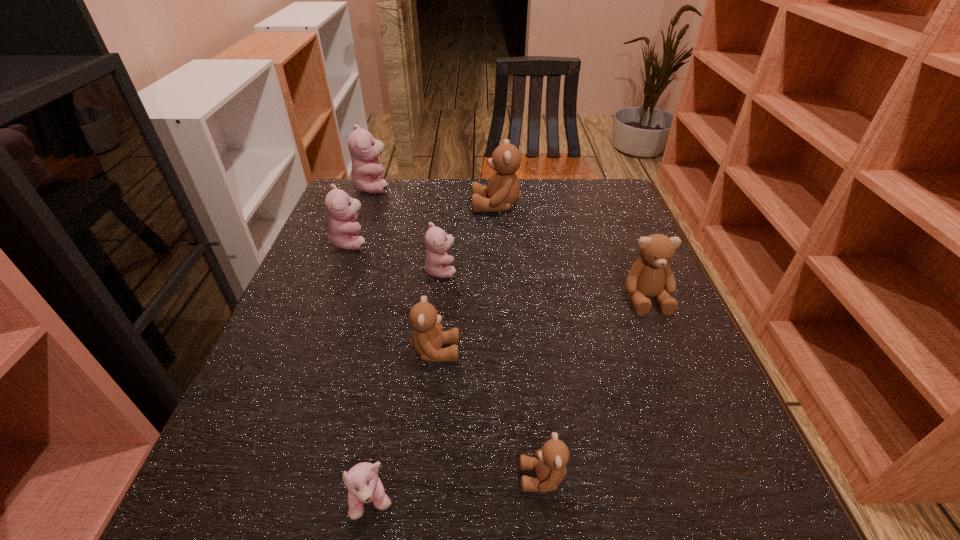
Find the location of a particular element. This screenshot has width=960, height=540. vacant space in between the second nearest brown teddy bear and the farthest pink teddy bear is located at coordinates (404, 269).

You are a GUI agent. You are given a task and a screenshot of the screen. Output one action in this format:
    pyautogui.click(x=<x>, y=<y>)
    Task: Click on the object that is the closest to the farthest brown teddy bear
    This screenshot has height=540, width=960.
    Given the screenshot: What is the action you would take?
    pyautogui.click(x=437, y=242)

At what (x,y) coordinates should I click in order to perform the action: click on object that is the third closest to the third farthest brown teddy bear. Please return your answer as a coordinate pair (x, y). This screenshot has width=960, height=540. Looking at the image, I should click on (364, 486).

Locate which teddy bear ranks in proximity to the second smallest pink teddy bear. Please provide its 2D coordinates. Your answer should be formatted as a tuple, i.e. [(x, y)], where the tuple contains the x and y coordinates of a point satisfying the conditions above.

[(344, 233)]

At what (x,y) coordinates should I click in order to perform the action: click on teddy bear that is the fourth nearest to the smallest pink teddy bear. Please return your answer as a coordinate pair (x, y). Looking at the image, I should click on (651, 275).

The image size is (960, 540). I want to click on pink teddy bear that can be found as the closest to the fourth farthest teddy bear, so click(x=344, y=233).

The height and width of the screenshot is (540, 960). Find the location of `pink teddy bear that is the second nearest to the biggest brown teddy bear`. pink teddy bear that is the second nearest to the biggest brown teddy bear is located at coordinates (366, 175).

You are a GUI agent. You are given a task and a screenshot of the screen. Output one action in this format:
    pyautogui.click(x=<x>, y=<y>)
    Task: Click on the brown teddy bear identified as the third closest to the second biggest pink teddy bear
    Image resolution: width=960 pixels, height=540 pixels.
    Given the screenshot: What is the action you would take?
    pyautogui.click(x=651, y=275)

Where is `brown teddy bear that is the third nearest to the biggest pink teddy bear`? This screenshot has height=540, width=960. brown teddy bear that is the third nearest to the biggest pink teddy bear is located at coordinates (651, 275).

This screenshot has width=960, height=540. Identify the location of free space that satisfies the following two spatial constraints: 1. on the front-facing side of the rightmost brown teddy bear; 2. on the front-facing side of the smallest brown teddy bear. (719, 477).